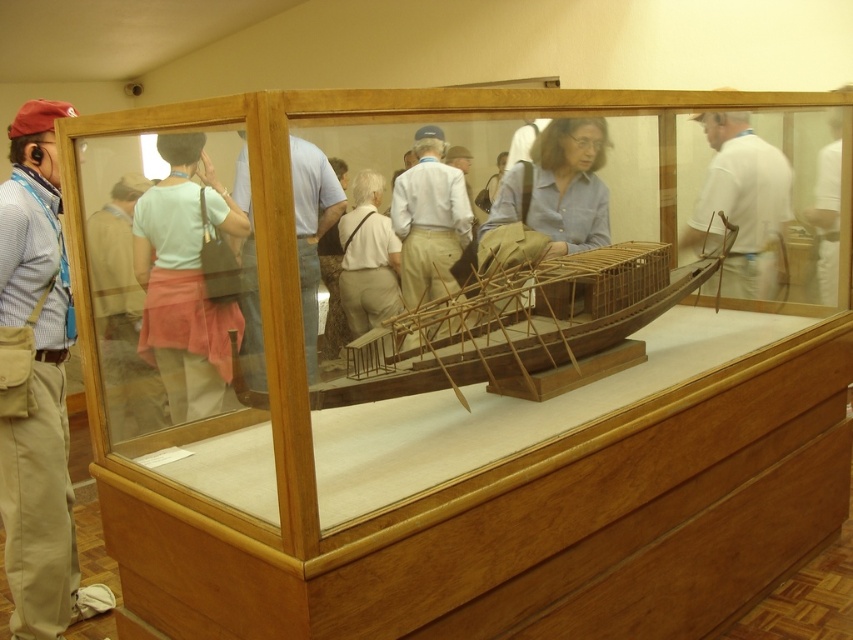
You are standing in front of the museum exhibit and want to touch the boat model. You notice two points marked on the glass case at coordinates point (231, 214) and point (312, 301). Which point is closer to you?

Point (231, 214) is closer to the viewer than point (312, 301).